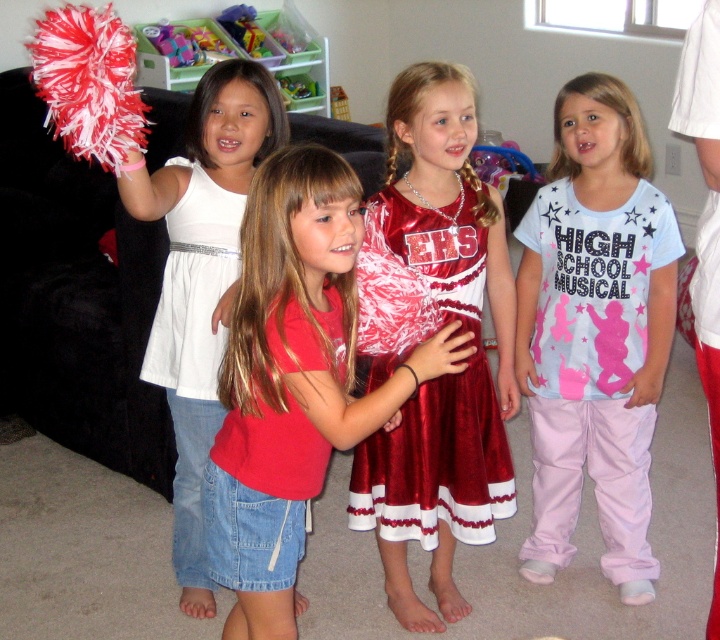
Measure the distance from shiny maroon dress at center to red/white fluffy pom-pom at left.

shiny maroon dress at center is 79.86 centimeters from red/white fluffy pom-pom at left.

The image size is (720, 640). I want to click on shiny maroon dress at center, so click(428, 380).

What do you see at coordinates (428, 380) in the screenshot?
I see `shiny maroon dress at center` at bounding box center [428, 380].

At what (x,y) coordinates should I click in order to perform the action: click on shiny maroon dress at center. Please return your answer as a coordinate pair (x, y). Image resolution: width=720 pixels, height=640 pixels. Looking at the image, I should click on (428, 380).

Can you confirm if light blue cotton shirt at center is thinner than plastic toy at upper center?

In fact, light blue cotton shirt at center might be wider than plastic toy at upper center.

Is point (634, 132) less distant than point (260, 45)?

Yes, point (634, 132) is in front of point (260, 45).

At what (x,y) coordinates should I click in order to perform the action: click on light blue cotton shirt at center. Please return your answer as a coordinate pair (x, y). This screenshot has width=720, height=640. Looking at the image, I should click on (x=595, y=332).

Does white satin dress at center have a greater height compared to translucent plastic toy at upper center?

Yes, white satin dress at center is taller than translucent plastic toy at upper center.

Between point (158, 385) and point (288, 80), which one is positioned behind?

Positioned behind is point (288, 80).

Who is more forward, [193,372] or [320,93]?

Positioned in front is point [193,372].

Find the location of a particular element. This screenshot has width=720, height=640. white satin dress at center is located at coordinates (194, 285).